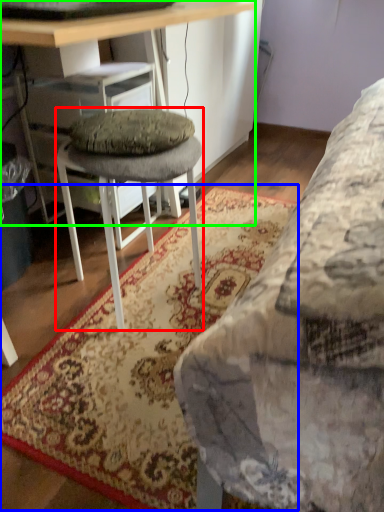
Question: Estimate the real-world distances between objects in this image. Which object is closer to stool (highlighted by a red box), mat (highlighted by a blue box) or desk (highlighted by a green box)?

Choices:
 (A) mat
 (B) desk

Answer: (A)